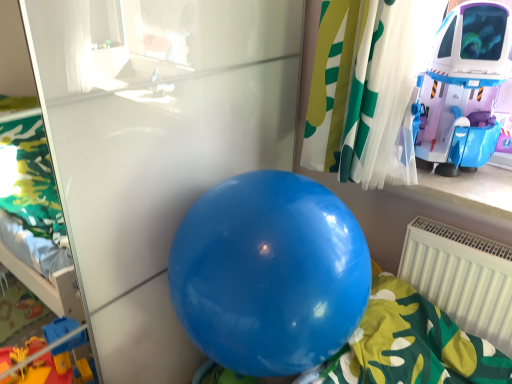
Question: From a real-world perspective, is white plastic radiator at lower right under glossy blue balloon at center?

Choices:
 (A) yes
 (B) no

Answer: (A)

Question: Considering the relative positions of white plastic radiator at lower right and glossy blue balloon at center in the image provided, is white plastic radiator at lower right to the right of glossy blue balloon at center from the viewer's perspective?

Choices:
 (A) yes
 (B) no

Answer: (A)

Question: From the image's perspective, is white plastic radiator at lower right under glossy blue balloon at center?

Choices:
 (A) no
 (B) yes

Answer: (B)

Question: Can you confirm if white plastic radiator at lower right is thinner than glossy blue balloon at center?

Choices:
 (A) yes
 (B) no

Answer: (A)

Question: From the image's perspective, is white plastic radiator at lower right on top of glossy blue balloon at center?

Choices:
 (A) no
 (B) yes

Answer: (A)

Question: Does white plastic radiator at lower right have a lesser height compared to glossy blue balloon at center?

Choices:
 (A) no
 (B) yes

Answer: (B)

Question: From the image's perspective, would you say glossy blue balloon at center is positioned over shiny plastic spaceship at upper right?

Choices:
 (A) yes
 (B) no

Answer: (B)

Question: From the image's perspective, would you say glossy blue balloon at center is shown under shiny plastic spaceship at upper right?

Choices:
 (A) yes
 (B) no

Answer: (A)

Question: Can you confirm if glossy blue balloon at center is shorter than shiny plastic spaceship at upper right?

Choices:
 (A) no
 (B) yes

Answer: (A)

Question: Is the position of glossy blue balloon at center less distant than that of shiny plastic spaceship at upper right?

Choices:
 (A) no
 (B) yes

Answer: (B)

Question: Is glossy blue balloon at center not inside shiny plastic spaceship at upper right?

Choices:
 (A) yes
 (B) no

Answer: (A)

Question: Is glossy blue balloon at center taller than shiny plastic spaceship at upper right?

Choices:
 (A) no
 (B) yes

Answer: (B)

Question: Are glossy blue balloon at center and white plastic radiator at lower right located far from each other?

Choices:
 (A) no
 (B) yes

Answer: (A)